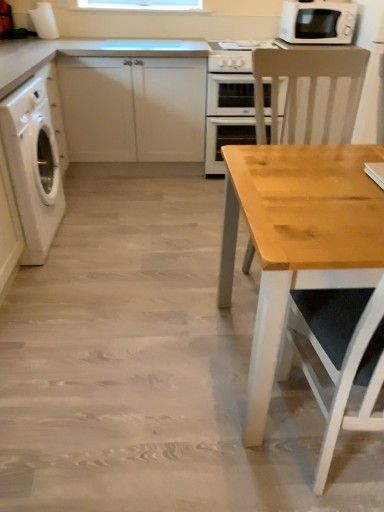
Where is `vacant space that is to the left of light wood chair at right`? vacant space that is to the left of light wood chair at right is located at coordinates (188, 293).